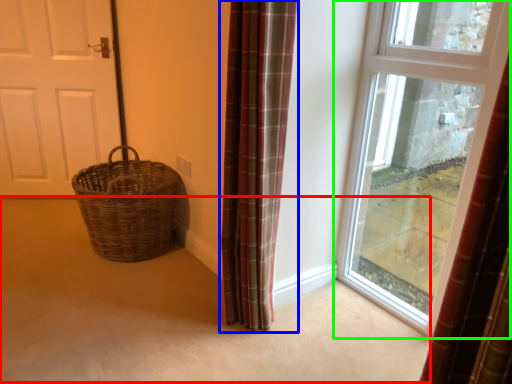
Question: Which object is positioned closest to corridor (highlighted by a red box)? Select from curtain (highlighted by a blue box) and window (highlighted by a green box).

Choices:
 (A) curtain
 (B) window

Answer: (A)